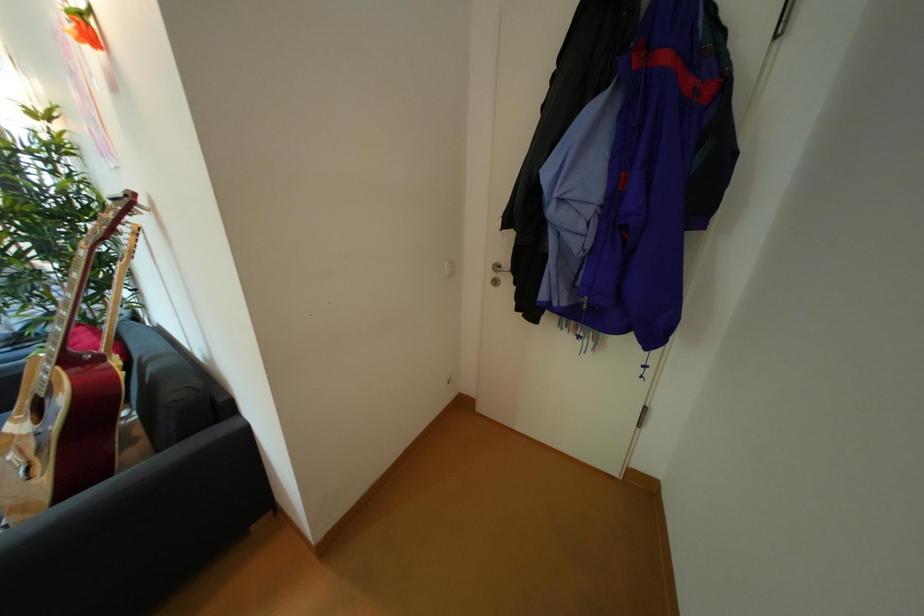
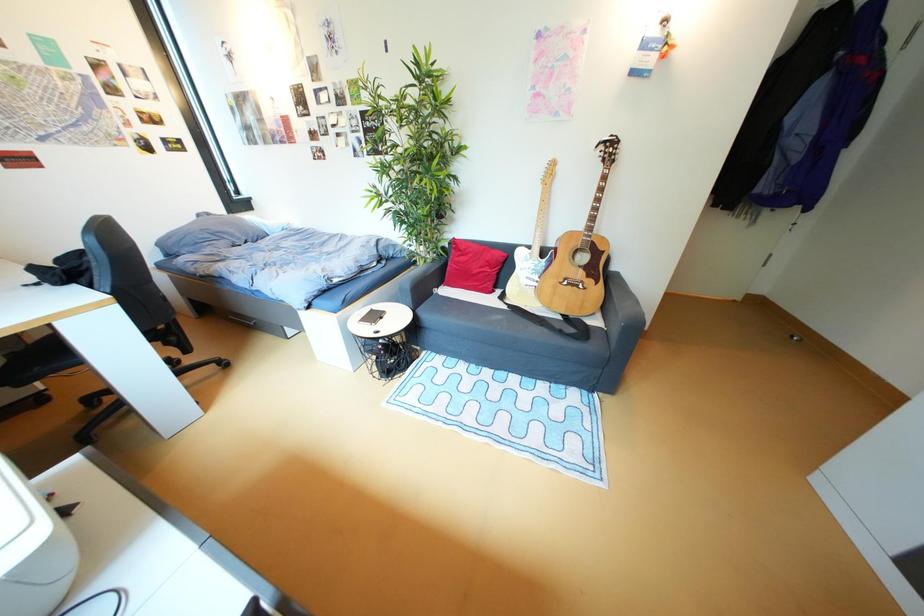
Question: Which direction would the cameraman need to move to produce the second image? Reply with the corresponding letter.

Choices:
 (A) Left
 (B) Right
 (C) Forward
 (D) Backward

Answer: (A)